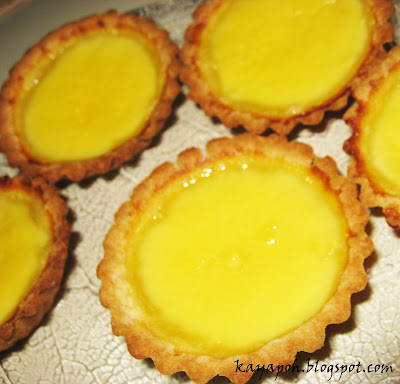
What are the coordinates of `indents in tray` in the screenshot? It's located at (105, 358), (56, 351), (85, 288), (131, 180).